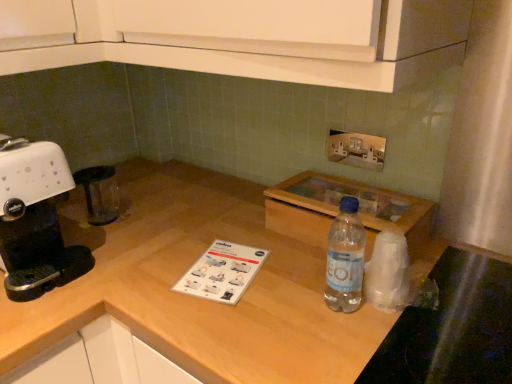
Locate an element on the screen. free space to the back side of clear plastic bottle at center is located at coordinates (294, 255).